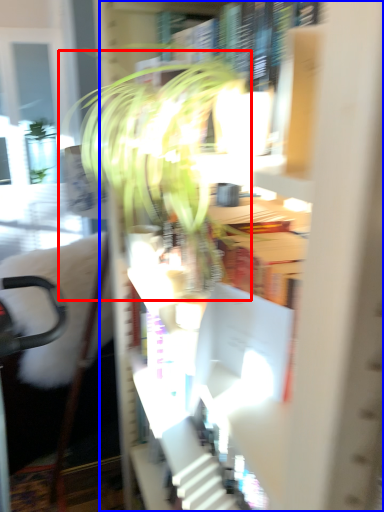
Question: Which point is further to the camera, houseplant (highlighted by a red box) or bookcase (highlighted by a blue box)?

Choices:
 (A) houseplant
 (B) bookcase

Answer: (A)